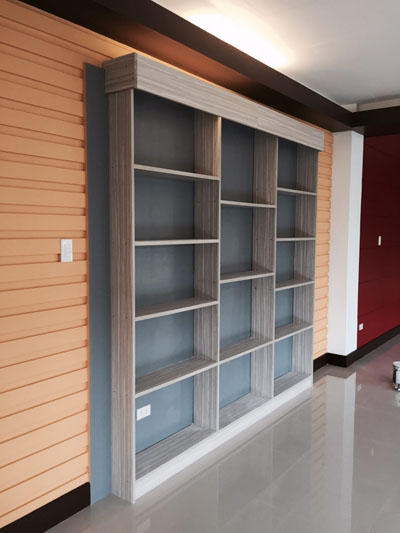
Identify the location of bottom shelves. click(x=176, y=451), click(x=234, y=414), click(x=296, y=377).